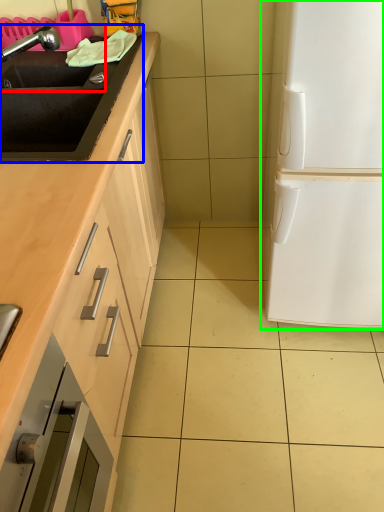
Question: Which object is positioned farthest from sink (highlighted by a red box)? Select from sink (highlighted by a blue box) and fridge (highlighted by a green box).

Choices:
 (A) sink
 (B) fridge

Answer: (B)